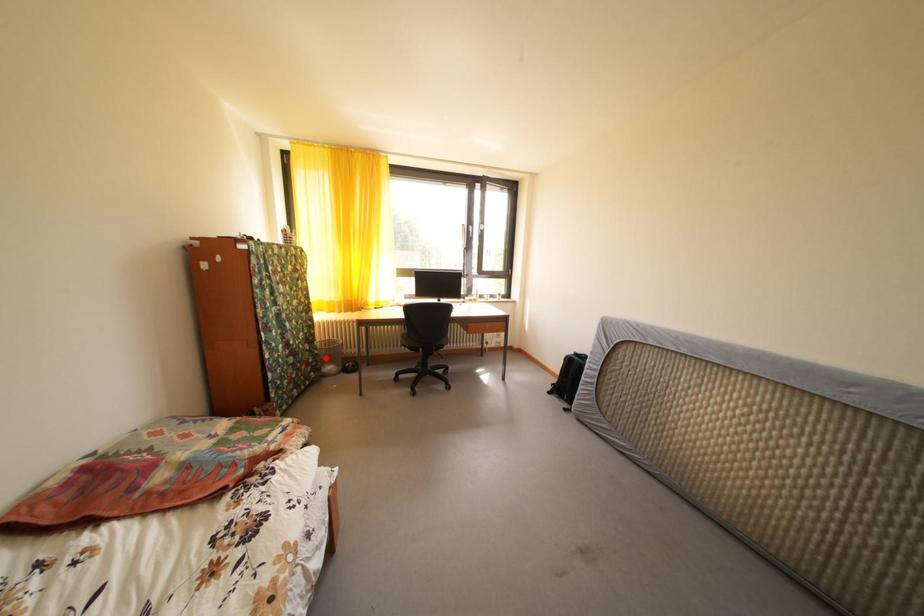
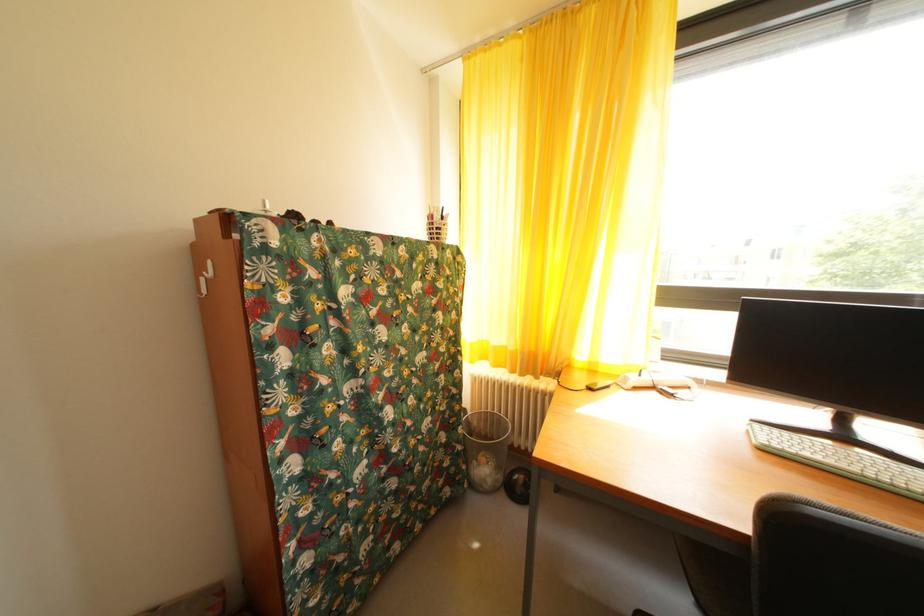
The point at the highlighted location is marked in the first image. Where is the corresponding point in the second image?

(468, 454)